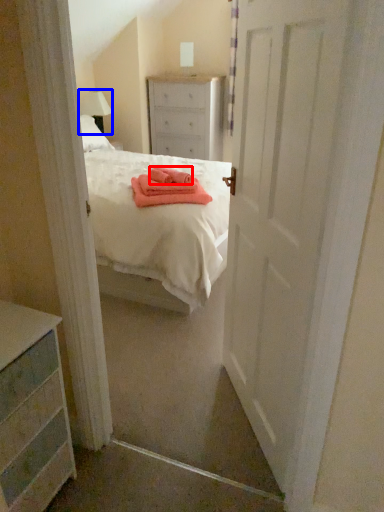
Question: Which of the following is the closest to the observer, cloth (highlighted by a red box) or lamp (highlighted by a blue box)?

Choices:
 (A) cloth
 (B) lamp

Answer: (A)